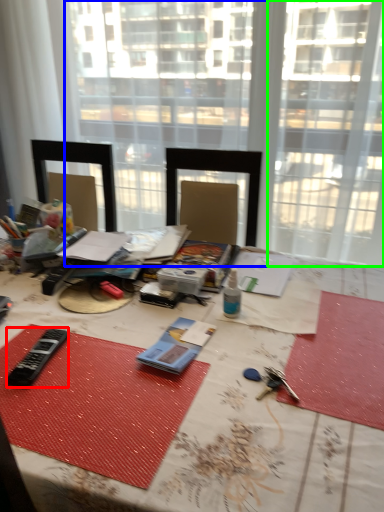
Question: Which object is the farthest from equipment (highlighted by a red box)? Choose among these: window (highlighted by a blue box) or window (highlighted by a green box).

Choices:
 (A) window
 (B) window

Answer: (A)